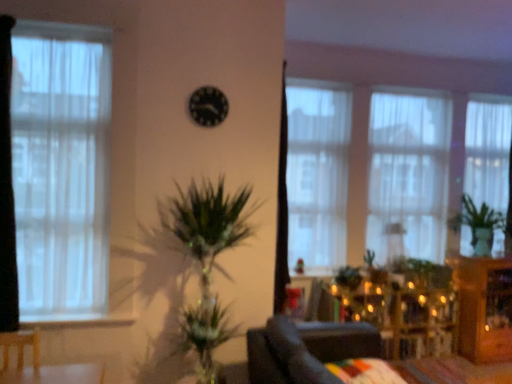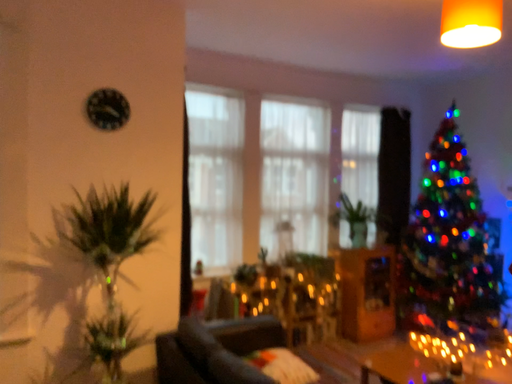
Question: How did the camera likely rotate when shooting the video?

Choices:
 (A) rotated left
 (B) rotated right

Answer: (B)